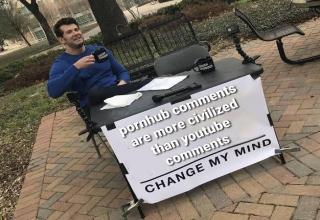
At what (x,y) coordinates should I click in order to perform the action: click on chairs. Please return your answer as a coordinate pair (x, y). The height and width of the screenshot is (220, 320). Looking at the image, I should click on (263, 37), (150, 28), (127, 34), (90, 128).